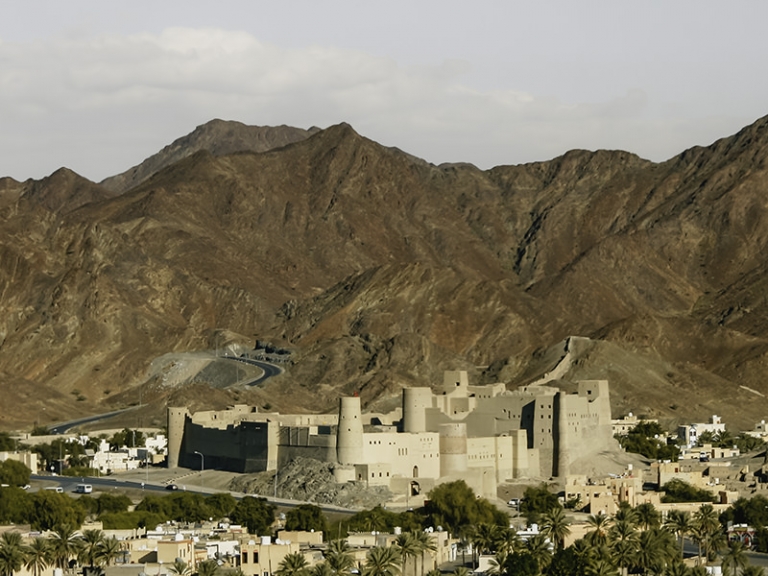
The width and height of the screenshot is (768, 576). What are the coordinates of `wall` in the screenshot? It's located at (557, 370).